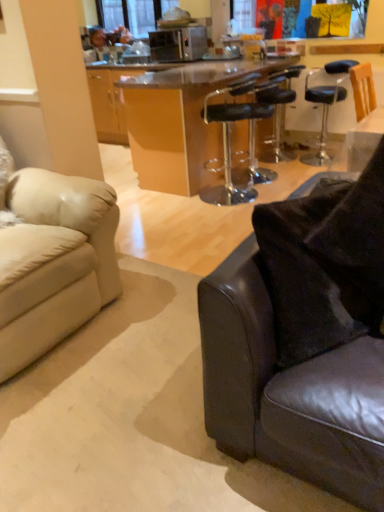
Question: Is the position of transparent plastic bar stool at center, which appears as the first chair when viewed from the front, less distant than that of leather couch at lower right, acting as the first studio couch starting from the right?

Choices:
 (A) yes
 (B) no

Answer: (B)

Question: Is transparent plastic bar stool at center, the second chair in the right-to-left sequence, positioned with its back to leather couch at lower right, acting as the first studio couch starting from the right?

Choices:
 (A) yes
 (B) no

Answer: (B)

Question: Is the depth of transparent plastic bar stool at center, the second chair in the right-to-left sequence, greater than that of leather couch at lower right, the 2th studio couch in the left-to-right sequence?

Choices:
 (A) yes
 (B) no

Answer: (A)

Question: Can you confirm if transparent plastic bar stool at center, the 2th chair positioned from the back, is positioned to the left of leather couch at lower right, the 2th studio couch in the left-to-right sequence?

Choices:
 (A) yes
 (B) no

Answer: (A)

Question: Can you confirm if transparent plastic bar stool at center, the second chair in the right-to-left sequence, is taller than leather couch at lower right, the 2th studio couch in the left-to-right sequence?

Choices:
 (A) yes
 (B) no

Answer: (A)

Question: In terms of height, does black leather bar stool at center, which appears as the 2th chair when viewed from the left, look taller or shorter compared to clear glass window screen at upper center?

Choices:
 (A) tall
 (B) short

Answer: (A)

Question: Looking at their shapes, would you say black leather bar stool at center, which appears as the 2th chair when viewed from the left, is wider or thinner than clear glass window screen at upper center?

Choices:
 (A) wide
 (B) thin

Answer: (A)

Question: Is black leather bar stool at center, which is the second chair from front to back, to the left or to the right of clear glass window screen at upper center in the image?

Choices:
 (A) left
 (B) right

Answer: (B)

Question: Would you say black leather bar stool at center, which is the second chair from front to back, is inside or outside clear glass window screen at upper center?

Choices:
 (A) inside
 (B) outside

Answer: (B)

Question: Is black leather bar stool at center, arranged as the first chair when viewed from the back, inside or outside of transparent plastic bar stool at center, which appears as the first chair when viewed from the front?

Choices:
 (A) inside
 (B) outside

Answer: (B)

Question: In terms of height, does black leather bar stool at center, which is the second chair from front to back, look taller or shorter compared to transparent plastic bar stool at center, the second chair in the right-to-left sequence?

Choices:
 (A) tall
 (B) short

Answer: (B)

Question: Does point (284, 95) appear closer or farther from the camera than point (251, 140)?

Choices:
 (A) farther
 (B) closer

Answer: (B)

Question: Considering their positions, is black leather bar stool at center, arranged as the first chair when viewed from the back, located in front of or behind transparent plastic bar stool at center, the second chair in the right-to-left sequence?

Choices:
 (A) front
 (B) behind

Answer: (B)

Question: From their relative heights in the image, would you say leather couch at lower right, the 2th studio couch in the left-to-right sequence, is taller or shorter than black leather bar stool at center, which is the second chair from front to back?

Choices:
 (A) short
 (B) tall

Answer: (A)

Question: From the image's perspective, is leather couch at lower right, the 2th studio couch in the left-to-right sequence, positioned above or below black leather bar stool at center, which appears as the 2th chair when viewed from the left?

Choices:
 (A) above
 (B) below

Answer: (B)